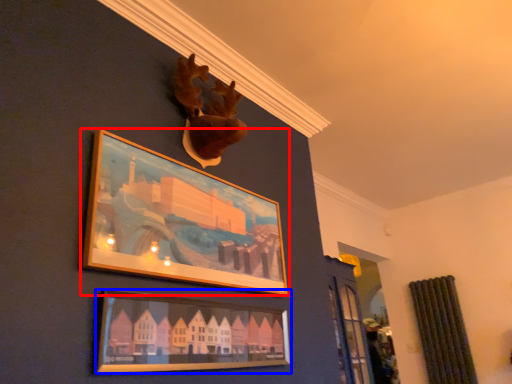
Question: Which object is closer to the camera taking this photo, picture frame (highlighted by a red box) or picture frame (highlighted by a blue box)?

Choices:
 (A) picture frame
 (B) picture frame

Answer: (B)